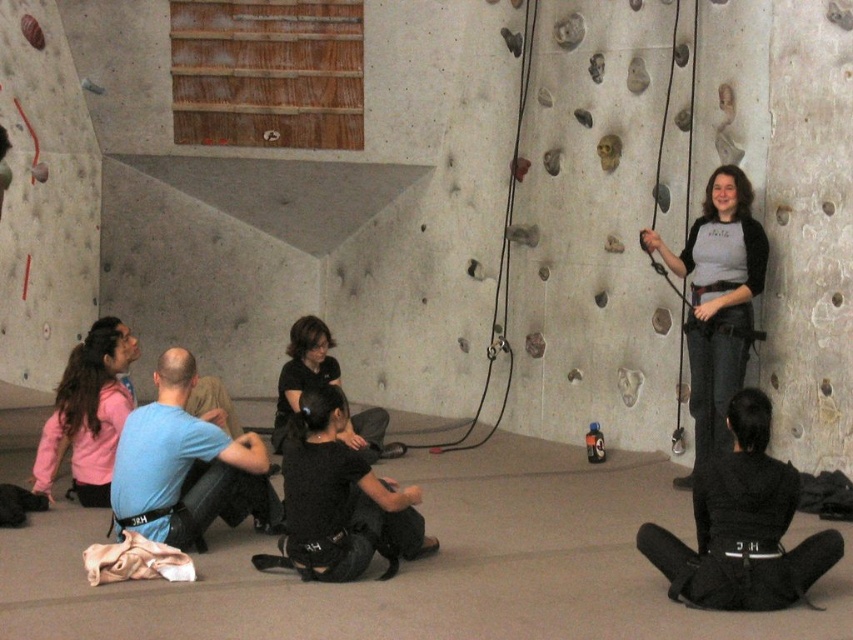
Does point (724, 480) come in front of point (161, 372)?

Yes, it is.

Where is `black fabric squat at lower right`? black fabric squat at lower right is located at coordinates (741, 525).

Is point (381, 515) positioned after point (387, 456)?

No, (381, 515) is closer to viewer.

Who is higher up, black matte squat at center or black matte shirt at center?

Positioned higher is black matte shirt at center.

Between point (300, 413) and point (283, 403), which one is positioned in front?

Point (300, 413) is in front.

Where is `black matte squat at center`? black matte squat at center is located at coordinates (341, 500).

Does gray matte shirt at upper right have a lesser width compared to black matte shirt at center?

In fact, gray matte shirt at upper right might be wider than black matte shirt at center.

Is gray matte shirt at upper right positioned behind black matte shirt at center?

No, it is in front of black matte shirt at center.

You are a GUI agent. You are given a task and a screenshot of the screen. Output one action in this format:
    pyautogui.click(x=<x>, y=<y>)
    Task: Click on the gray matte shirt at upper right
    The height and width of the screenshot is (640, 853).
    Given the screenshot: What is the action you would take?
    pyautogui.click(x=717, y=301)